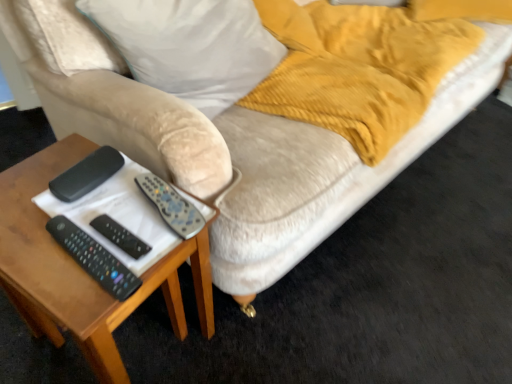
This screenshot has width=512, height=384. Identify the location of vacant area situated to the left side of black plastic remote at lower left, which appears as the third remote when viewed from the top. (33, 245).